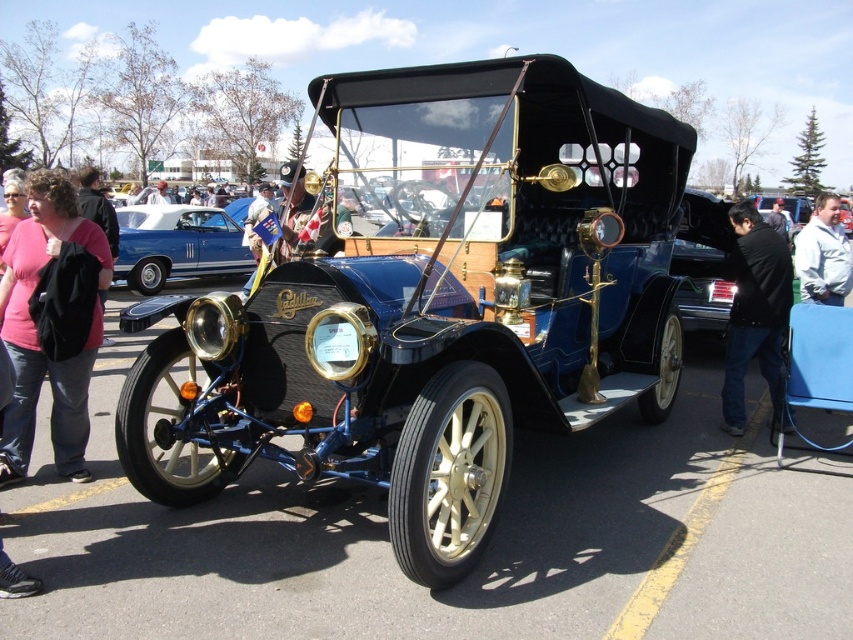
Question: Can you confirm if black leather jacket at lower right is smaller than black leather jacket at center?

Choices:
 (A) yes
 (B) no

Answer: (A)

Question: Among these objects, which one is nearest to the camera?

Choices:
 (A) black leather jacket at center
 (B) pink fabric shirt at upper left
 (C) white fleece jacket at center
 (D) shiny blue car at center

Answer: (B)

Question: Which point is farther to the camera?

Choices:
 (A) black leather jacket at lower right
 (B) white fleece jacket at center
 (C) black leather jacket at center

Answer: (C)

Question: Which object is the closest to the pink fabric shirt at upper left?

Choices:
 (A) black leather jacket at lower right
 (B) white fleece jacket at center
 (C) black leather jacket at center

Answer: (A)

Question: From the image, what is the correct spatial relationship of black leather jacket at lower right in relation to pink fabric shirt at upper left?

Choices:
 (A) above
 (B) below

Answer: (A)

Question: Does shiny blue car at center appear on the left side of white fleece jacket at center?

Choices:
 (A) yes
 (B) no

Answer: (A)